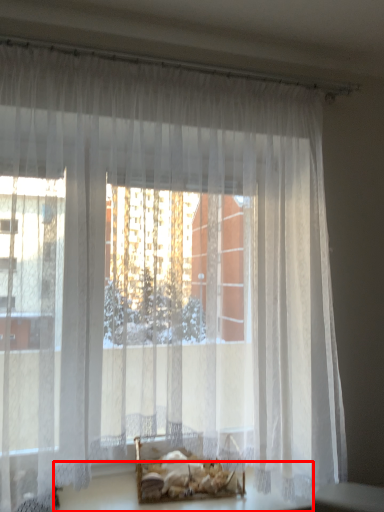
Question: From the image's perspective, what is the correct spatial relationship of table (annotated by the red box) in relation to bed?

Choices:
 (A) above
 (B) below

Answer: (B)